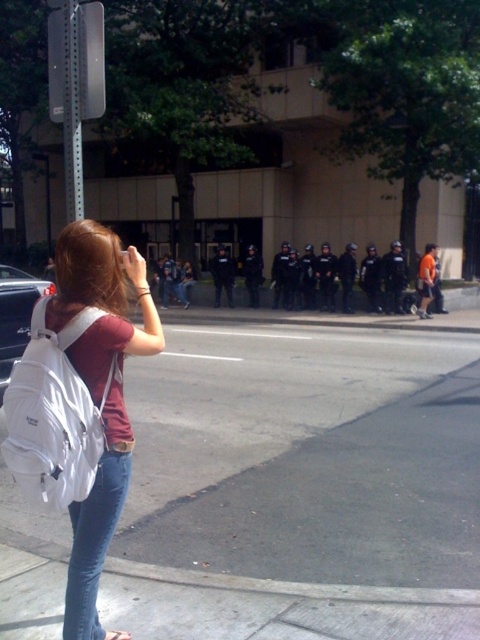
Consider the image. Does white fabric backpack at left lie behind jeans at lower left?

Yes.

Between point (110, 230) and point (98, 508), which one is positioned behind?

Point (110, 230)

Which is behind, point (132, 436) or point (98, 556)?

Point (98, 556)

This screenshot has height=640, width=480. I want to click on white fabric backpack at left, so click(99, 394).

Measure the distance between point (411, 529) and camera.

Point (411, 529) and camera are 4.64 meters apart.

Between gray asphalt pavement at lower center and metallic pole at upper left, which one has less height?

Standing shorter between the two is gray asphalt pavement at lower center.

Between point (283, 346) and point (81, 212), which one is positioned behind?

Positioned behind is point (283, 346).

Locate an element on the screen. Image resolution: width=480 pixels, height=640 pixels. gray asphalt pavement at lower center is located at coordinates (308, 452).

Is point (342, 483) farther from viewer compared to point (100, 568)?

Yes.

Looking at this image, between gray asphalt pavement at lower center and jeans at lower left, which one appears on the right side from the viewer's perspective?

gray asphalt pavement at lower center is more to the right.

Which is in front, point (432, 541) or point (74, 636)?

Positioned in front is point (74, 636).

Locate an element on the screen. This screenshot has height=640, width=480. gray asphalt pavement at lower center is located at coordinates (308, 452).